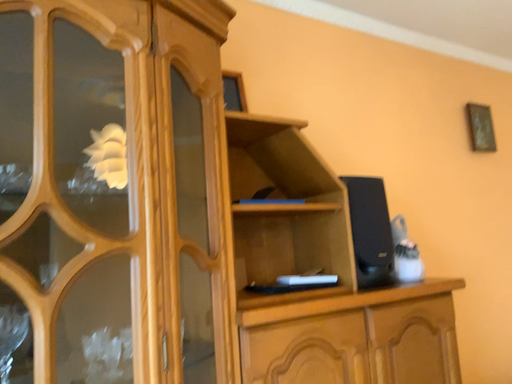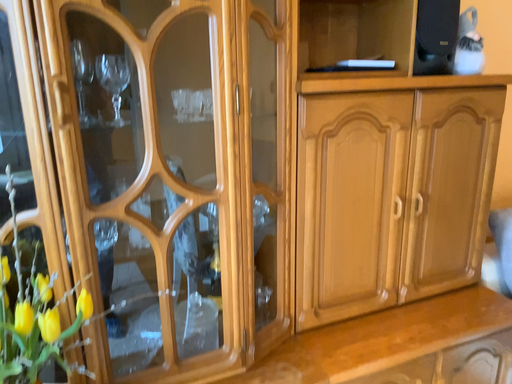
Question: How did the camera likely rotate when shooting the video?

Choices:
 (A) rotated upward
 (B) rotated downward

Answer: (B)